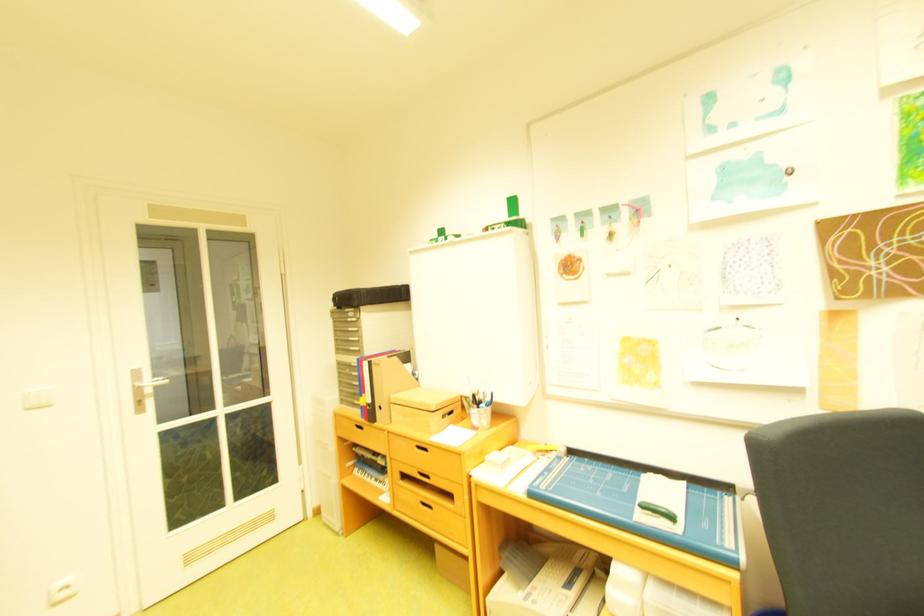
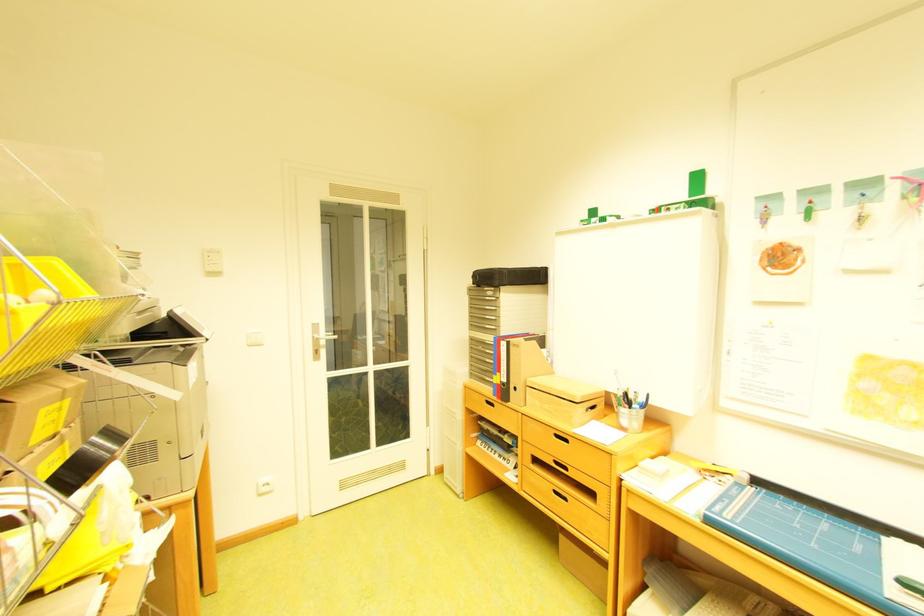
Locate, in the second image, the point that corresponds to pixel 148 385 in the first image.

(327, 337)